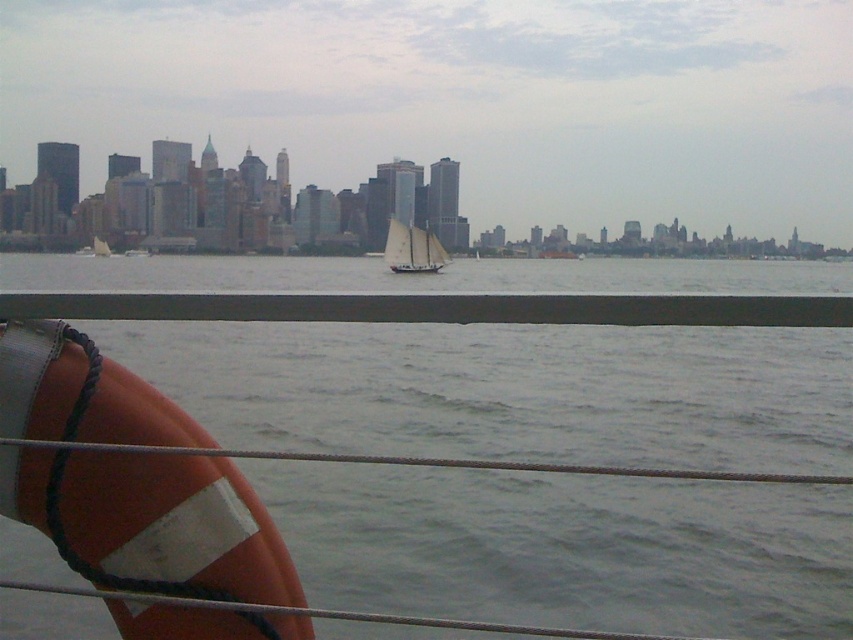
You are on a boat and want to know the exact coordinates of the gray water at center. What are its coordinates?

The gray water at center is located at point (509, 390).

You are standing on the deck of a boat and need to locate the orange rubber life jacket at lower left. According to the coordinates provided, where exactly should you look to find it?

The orange rubber life jacket at lower left is located at coordinates point (151,522).